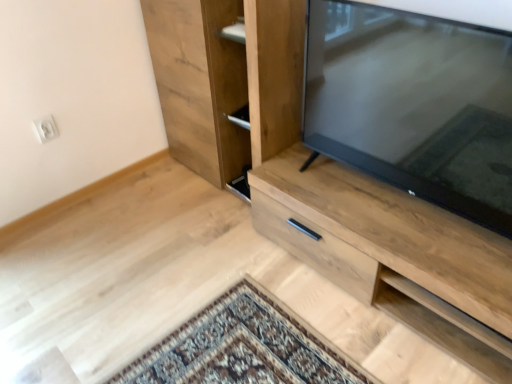
Identify the location of free point below matte black tv at right (from a real-world perspective). (399, 207).